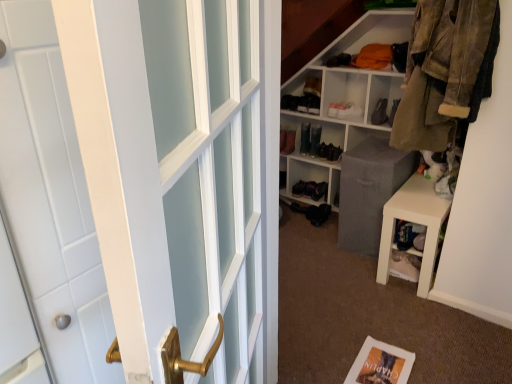
Image resolution: width=512 pixels, height=384 pixels. Describe the element at coordinates (315, 139) in the screenshot. I see `shiny black boot at center, marked as the third shoe in a right-to-left arrangement` at that location.

This screenshot has height=384, width=512. What are the coordinates of `white matte bookshelf at center` in the screenshot? It's located at (479, 208).

In order to face matte black boot at upper center, which ranks as the 2th shoe in right-to-left order, should I rotate leftwards or rightwards?

You should look right and rotate roughly 13.010 degrees.

Describe the element at coordinates (413, 222) in the screenshot. I see `white matte stool at lower right` at that location.

What is the approximate height of white matte stool at lower right?

45.95 centimeters.

This screenshot has height=384, width=512. I want to click on brown suede shoe at center, which appears as the first shoe when viewed from the right, so click(379, 112).

This screenshot has width=512, height=384. I want to click on white cube shelf at upper right, so (x=344, y=97).

Which of these two, shiny black boot at center, positioned as the 2th shoe in left-to-right order, or white glossy door handle at left, is smaller?

shiny black boot at center, positioned as the 2th shoe in left-to-right order.

Between point (309, 150) and point (240, 317), which one is positioned behind?

The point (309, 150) is more distant.

Is shiny black boot at center, marked as the third shoe in a right-to-left arrangement, directly adjacent to white glossy door handle at left?

shiny black boot at center, marked as the third shoe in a right-to-left arrangement, and white glossy door handle at left are not in contact.

Could white glossy door handle at left be considered to be inside shiny black boot at center, positioned as the 2th shoe in left-to-right order?

No.

Considering the relative positions of camouflage fabric jacket at upper right and white matte bookshelf at center in the image provided, is camouflage fabric jacket at upper right to the right of white matte bookshelf at center from the viewer's perspective?

Yes.

From a real-world perspective, is camouflage fabric jacket at upper right physically below white matte bookshelf at center?

No, from a real-world perspective, camouflage fabric jacket at upper right is not below white matte bookshelf at center.

Considering the sizes of camouflage fabric jacket at upper right and white matte bookshelf at center in the image, is camouflage fabric jacket at upper right wider or thinner than white matte bookshelf at center?

Clearly, camouflage fabric jacket at upper right has more width compared to white matte bookshelf at center.

This screenshot has height=384, width=512. Find the location of `clothing above the white matte bookshelf at center (from the image's perspective)`. clothing above the white matte bookshelf at center (from the image's perspective) is located at coordinates (446, 71).

From the image's perspective, which object appears higher, brown suede shoe at center, which is counted as the fourth shoe, starting from the left, or shiny black shoe at center, which ranks as the first shoe in left-to-right order?

brown suede shoe at center, which is counted as the fourth shoe, starting from the left, from the image's perspective.

I want to click on shoe that is the 2nd object above the shiny black shoe at center, which ranks as the first shoe in left-to-right order (from a real-world perspective), so click(379, 112).

Is brown suede shoe at center, which is counted as the fourth shoe, starting from the left, not near shiny black shoe at center, placed as the 4th shoe when sorted from right to left?

Actually, brown suede shoe at center, which is counted as the fourth shoe, starting from the left, and shiny black shoe at center, placed as the 4th shoe when sorted from right to left, are a little close together.

Would you say brown suede shoe at center, which appears as the first shoe when viewed from the right, is inside or outside shiny black shoe at center, which ranks as the first shoe in left-to-right order?

brown suede shoe at center, which appears as the first shoe when viewed from the right, is not inside shiny black shoe at center, which ranks as the first shoe in left-to-right order, it's outside.

Is the depth of white matte stool at lower right greater than that of camouflage fabric jacket at upper right?

That is True.

Which is correct: white matte stool at lower right is inside camouflage fabric jacket at upper right, or outside of it?

white matte stool at lower right is outside camouflage fabric jacket at upper right.

Can you confirm if white matte stool at lower right is bigger than camouflage fabric jacket at upper right?

Correct, white matte stool at lower right is larger in size than camouflage fabric jacket at upper right.

In terms of height, does brown suede shoe at center, which is counted as the fourth shoe, starting from the left, look taller or shorter compared to white glossy door handle at left?

In the image, brown suede shoe at center, which is counted as the fourth shoe, starting from the left, appears to be shorter than white glossy door handle at left.

Based on the photo, is the depth of brown suede shoe at center, which is counted as the fourth shoe, starting from the left, less than that of white glossy door handle at left?

No, brown suede shoe at center, which is counted as the fourth shoe, starting from the left, is further to the viewer.

Is point (373, 118) behind point (64, 365)?

Yes, it is behind point (64, 365).

Is brown suede shoe at center, which is counted as the fourth shoe, starting from the left, looking in the opposite direction of white glossy door handle at left?

brown suede shoe at center, which is counted as the fourth shoe, starting from the left, is not turned away from white glossy door handle at left.

Considering the sizes of objects white matte stool at lower right and shiny black boot at center, positioned as the 2th shoe in left-to-right order, in the image provided, who is thinner, white matte stool at lower right or shiny black boot at center, positioned as the 2th shoe in left-to-right order,?

shiny black boot at center, positioned as the 2th shoe in left-to-right order, is thinner.

Is white matte stool at lower right bigger or smaller than shiny black boot at center, marked as the third shoe in a right-to-left arrangement?

Clearly, white matte stool at lower right is larger in size than shiny black boot at center, marked as the third shoe in a right-to-left arrangement.

Is white matte stool at lower right facing away from shiny black boot at center, marked as the third shoe in a right-to-left arrangement?

That's not correct — white matte stool at lower right is not looking away from shiny black boot at center, marked as the third shoe in a right-to-left arrangement.

Can you confirm if matte black boot at upper center, which ranks as the 2th shoe in right-to-left order, is shorter than camouflage fabric jacket at upper right?

Indeed, matte black boot at upper center, which ranks as the 2th shoe in right-to-left order, has a lesser height compared to camouflage fabric jacket at upper right.

Which is closer to the camera, (x=344, y=116) or (x=474, y=76)?

The point (x=474, y=76) is closer to the camera.

The height and width of the screenshot is (384, 512). I want to click on door in front of the shiny black boot at center, marked as the third shoe in a right-to-left arrangement, so click(156, 169).

This screenshot has width=512, height=384. In order to click on clothing on the right of the white matte bookshelf at center in this screenshot , I will do `click(446, 71)`.

When comparing their distances from white cube shelf at upper right, does white matte stool at lower right or white matte bookshelf at center seem closer?

white matte bookshelf at center is closer to white cube shelf at upper right.

Considering their positions, is shiny black boot at center, positioned as the 2th shoe in left-to-right order, positioned further to shiny black shoe at center, which ranks as the first shoe in left-to-right order, than white cube shelf at upper right?

white cube shelf at upper right is positioned further to the anchor shiny black shoe at center, which ranks as the first shoe in left-to-right order.

When comparing their distances from white matte bookshelf at center, does shiny black boot at center, positioned as the 2th shoe in left-to-right order, or brown suede shoe at center, which appears as the first shoe when viewed from the right, seem closer?

The object closer to white matte bookshelf at center is brown suede shoe at center, which appears as the first shoe when viewed from the right.

Based on their spatial positions, is white glossy door handle at left or white matte stool at lower right closer to shiny black shoe at center, which ranks as the first shoe in left-to-right order?

white matte stool at lower right is closer to shiny black shoe at center, which ranks as the first shoe in left-to-right order.

Estimate the real-world distances between objects in this image. Which object is further from camouflage fabric jacket at upper right, white cube shelf at upper right or white glossy door handle at left?

white glossy door handle at left is positioned further to the anchor camouflage fabric jacket at upper right.

From the image, which object appears to be farther from white glossy door handle at left, white matte bookshelf at center or matte black boot at upper center, placed as the 3th shoe when sorted from left to right?

matte black boot at upper center, placed as the 3th shoe when sorted from left to right, lies further to white glossy door handle at left than the other object.

Estimate the real-world distances between objects in this image. Which object is closer to shiny black shoe at center, placed as the 4th shoe when sorted from right to left, white matte bookshelf at center or matte black boot at upper center, which ranks as the 2th shoe in right-to-left order?

white matte bookshelf at center lies closer to shiny black shoe at center, placed as the 4th shoe when sorted from right to left, than the other object.

Considering their positions, is camouflage fabric jacket at upper right positioned closer to shiny black boot at center, positioned as the 2th shoe in left-to-right order, than matte black boot at upper center, placed as the 3th shoe when sorted from left to right?

Among the two, matte black boot at upper center, placed as the 3th shoe when sorted from left to right, is located nearer to shiny black boot at center, positioned as the 2th shoe in left-to-right order.

Where is `stool between white glossy door handle at left and brown suede shoe at center, which appears as the first shoe when viewed from the right, in the front-back direction`? The height and width of the screenshot is (384, 512). stool between white glossy door handle at left and brown suede shoe at center, which appears as the first shoe when viewed from the right, in the front-back direction is located at coordinates click(413, 222).

Where is `clothing between white glossy door handle at left and shiny black boot at center, positioned as the 2th shoe in left-to-right order, from front to back`? The height and width of the screenshot is (384, 512). clothing between white glossy door handle at left and shiny black boot at center, positioned as the 2th shoe in left-to-right order, from front to back is located at coordinates (446, 71).

Identify the location of clothing between white matte bookshelf at center and brown suede shoe at center, which is counted as the fourth shoe, starting from the left, along the z-axis. (446, 71).

This screenshot has width=512, height=384. I want to click on shelf positioned between white glossy door handle at left and matte black boot at upper center, which ranks as the 2th shoe in right-to-left order, from near to far, so click(x=344, y=97).